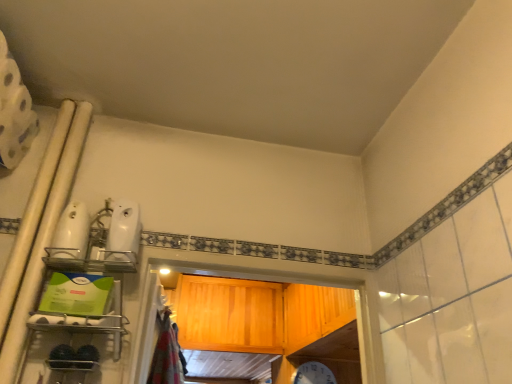
In order to face white plastic clock at center, should I rotate leftwards or rightwards?

A 7.890 degree turn to the right will do.

Image resolution: width=512 pixels, height=384 pixels. What do you see at coordinates (314, 374) in the screenshot? I see `white plastic clock at center` at bounding box center [314, 374].

The image size is (512, 384). I want to click on white plastic clock at center, so click(314, 374).

Find the location of a particular element. white plastic clock at center is located at coordinates (314, 374).